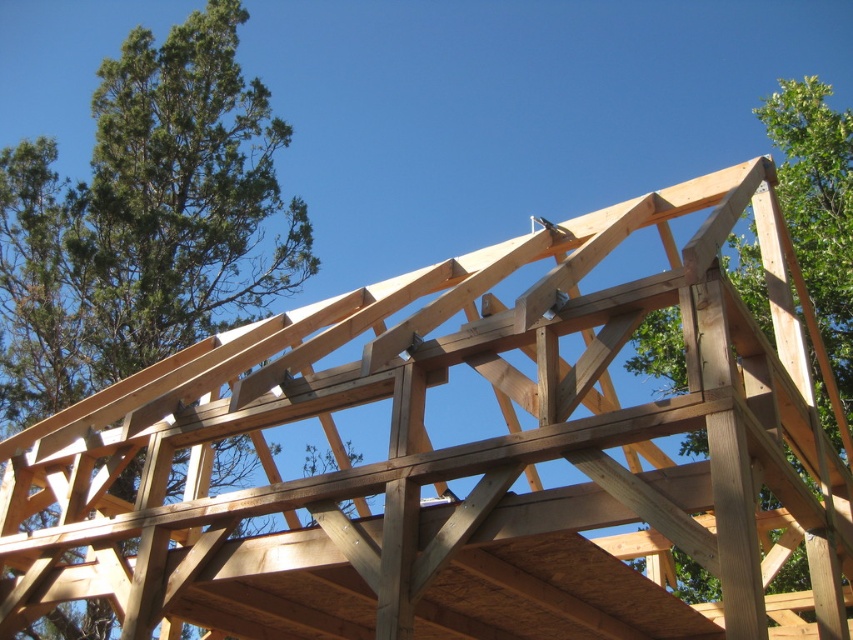
Question: Considering the relative positions of green leafy tree at upper left and natural wood tree at upper right in the image provided, where is green leafy tree at upper left located with respect to natural wood tree at upper right?

Choices:
 (A) above
 (B) below

Answer: (A)

Question: Which point is closer to the camera taking this photo?

Choices:
 (A) (811, 198)
 (B) (235, 221)

Answer: (A)

Question: Does green leafy tree at upper left appear on the left side of natural wood tree at upper right?

Choices:
 (A) yes
 (B) no

Answer: (A)

Question: Which of the following is the closest to the observer?

Choices:
 (A) green leafy tree at upper left
 (B) natural wood tree at upper right

Answer: (B)

Question: Does green leafy tree at upper left appear on the left side of natural wood tree at upper right?

Choices:
 (A) no
 (B) yes

Answer: (B)